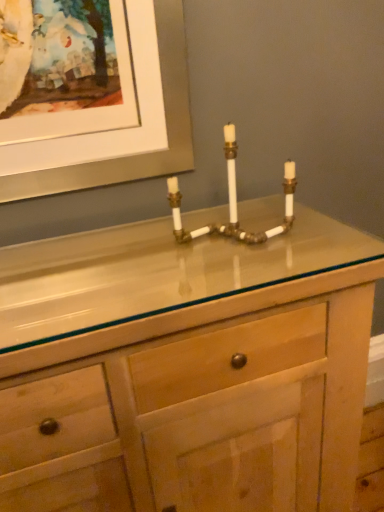
Identify the location of vacant area located to the right-hand side of brass/bronze pipe at center. The image size is (384, 512). (320, 239).